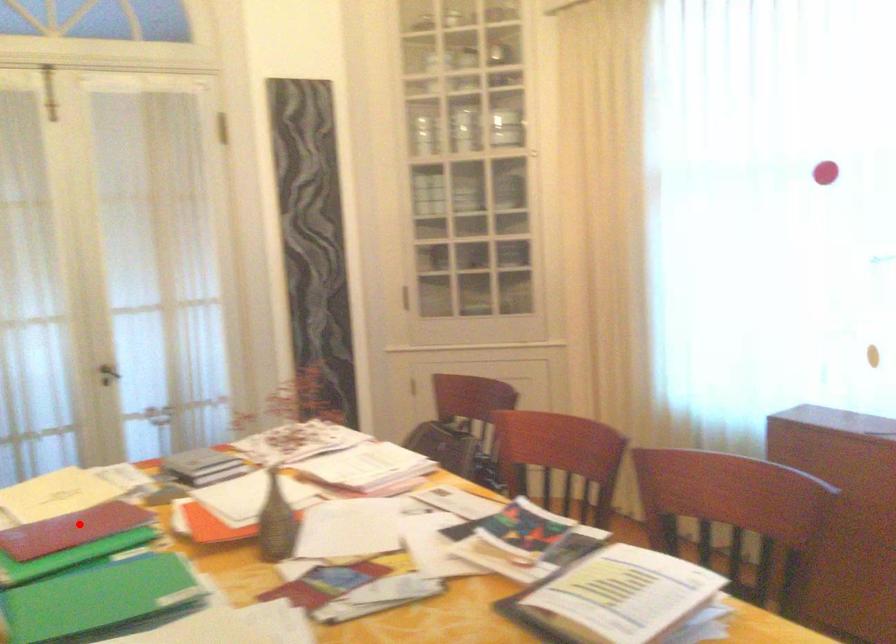
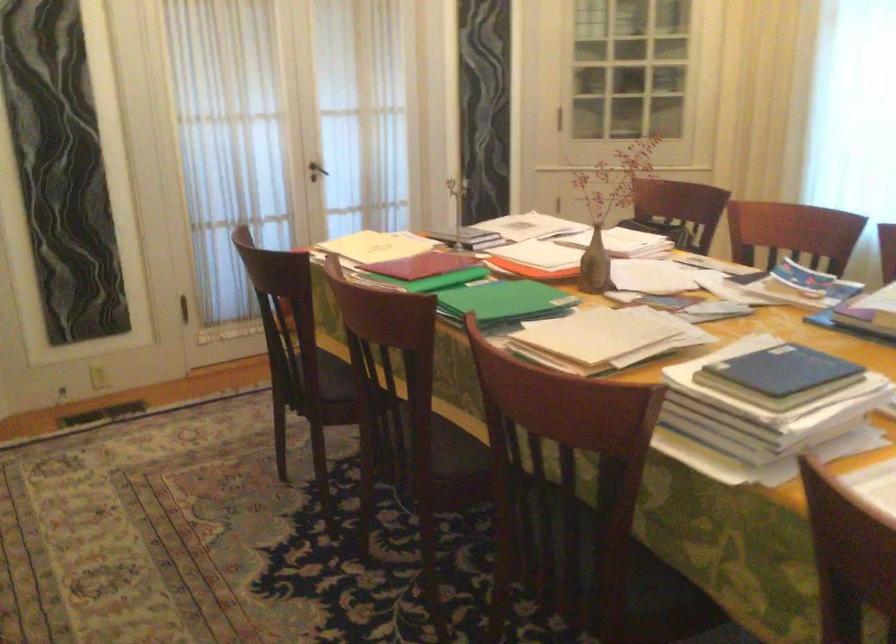
Question: I am providing you with two images of the same scene from different viewpoints. In image1, a red point is highlighted. Considering the same 3D point in image2, which of the following is correct?

Choices:
 (A) It is closer
 (B) It is farther

Answer: (B)